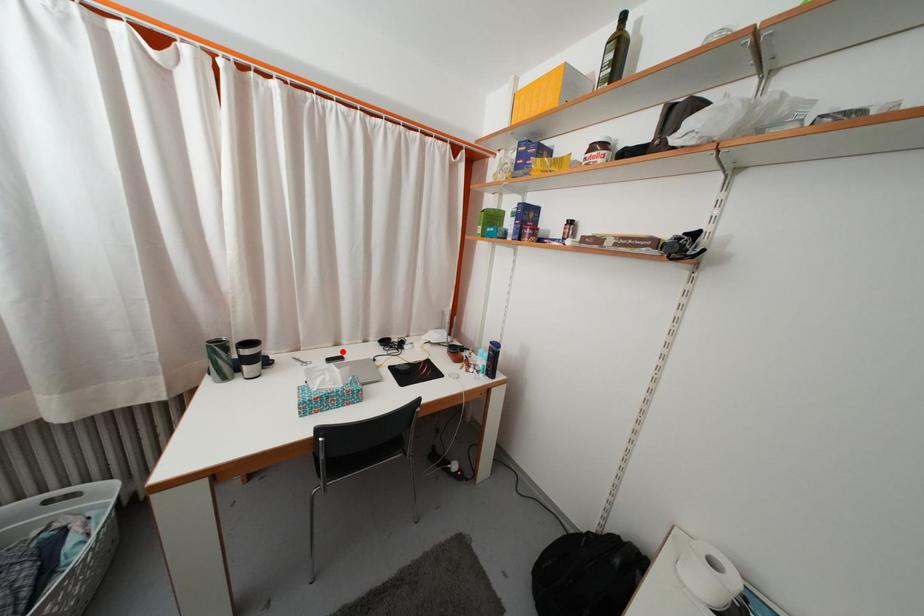
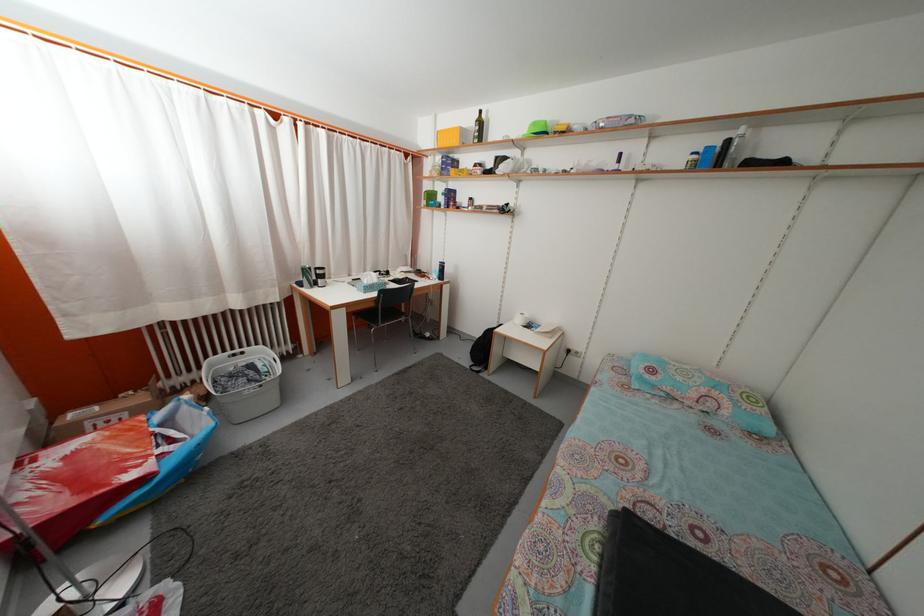
Locate, in the second image, the point that corresponds to the highlighted location in the first image.

(355, 283)